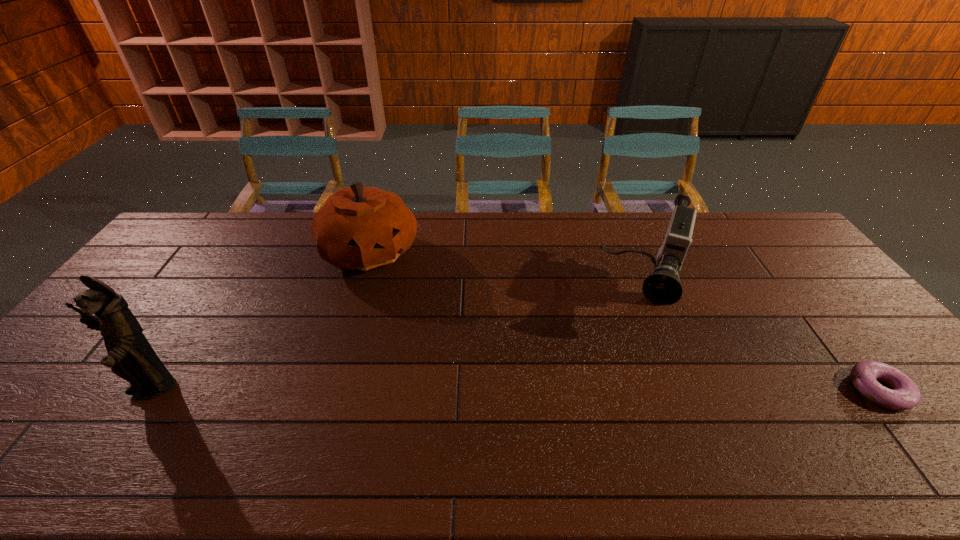
I want to click on vacant area situated 0.260m on the recording direction of the camcorder, so click(x=624, y=415).

Where is `vacant space located on the recording direction of the camcorder`? The height and width of the screenshot is (540, 960). vacant space located on the recording direction of the camcorder is located at coordinates (628, 402).

Find the location of `free location located 0.200m on the recording direction of the camcorder`. free location located 0.200m on the recording direction of the camcorder is located at coordinates (629, 395).

Where is `object located in the far edge section of the desktop`? object located in the far edge section of the desktop is located at coordinates (361, 228).

Find the location of `figurine positioned at the near edge`. figurine positioned at the near edge is located at coordinates (130, 356).

This screenshot has height=540, width=960. In order to click on doughnut located in the near edge section of the desktop in this screenshot , I will do `click(904, 394)`.

Locate an element on the screen. The image size is (960, 540). object that is positioned at the right edge is located at coordinates (904, 394).

I want to click on object that is at the near right corner, so click(904, 394).

Locate an element on the screen. The height and width of the screenshot is (540, 960). vacant space at the far edge is located at coordinates (465, 238).

Where is `free point at the near edge`? The image size is (960, 540). free point at the near edge is located at coordinates (420, 401).